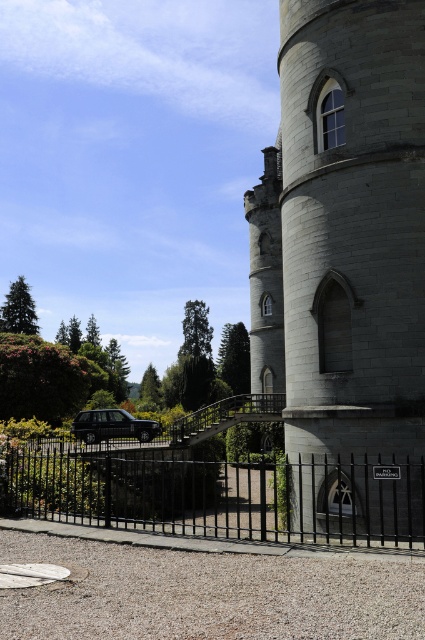
Question: Is gray stone tower at center bigger than black wrought iron fence at lower center?

Choices:
 (A) no
 (B) yes

Answer: (B)

Question: Among these objects, which one is farthest from the camera?

Choices:
 (A) black wrought iron fence at lower center
 (B) gray stone tower at center

Answer: (B)

Question: Among these points, which one is farthest from the camera?

Choices:
 (A) pyautogui.click(x=354, y=304)
 (B) pyautogui.click(x=164, y=506)

Answer: (B)

Question: Does gray stone tower at center lie behind black wrought iron fence at lower center?

Choices:
 (A) no
 (B) yes

Answer: (B)

Question: Does gray stone tower at center appear on the left side of black wrought iron fence at lower center?

Choices:
 (A) no
 (B) yes

Answer: (A)